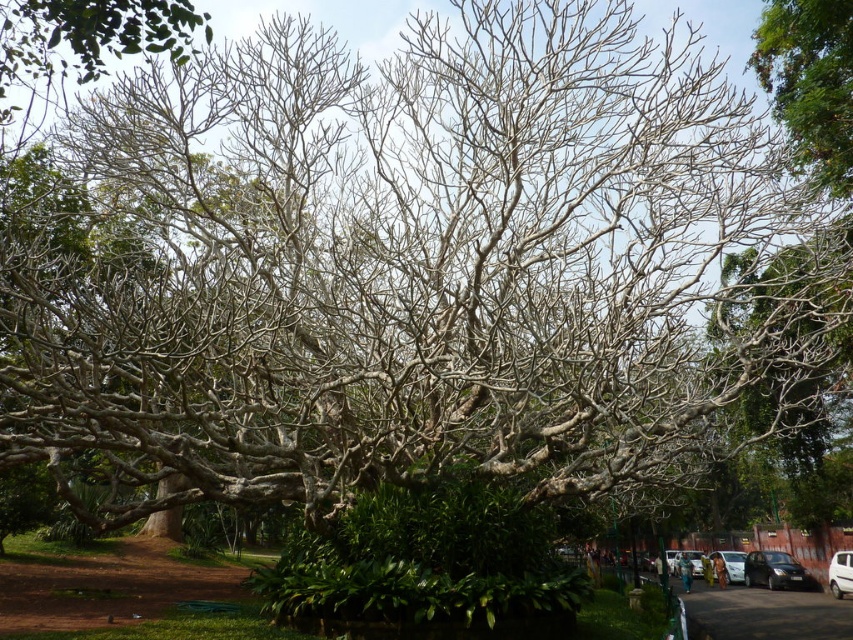
You are a delivery person trying to park a 3.5 meter wide delivery van between the white glossy car at center and the metallic silver car at center. Can you fit the van between them?

The distance between the white glossy car at center and the metallic silver car at center is 7.24 meters. Since the van is 3.5 meters wide, there is enough space to park it between them as 7.24 meters is greater than 3.5 meters.

You are a delivery person trying to park your van between the white glossy car at center and the metallic silver car at center. The van is 6 meters long. Can you fit the van between them?

The white glossy car at center is larger than the metallic silver car at center. However, the distance between them is not specified in the provided information, so it is impossible to determine if the van can fit.